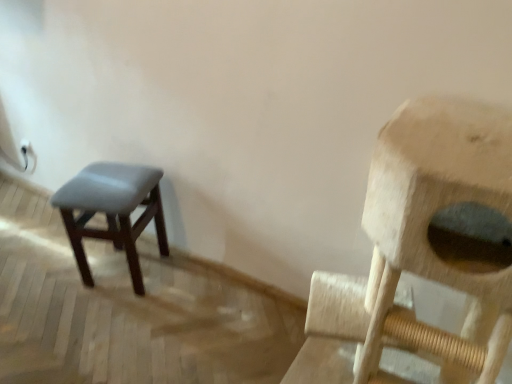
The image size is (512, 384). Find the location of `vacant space situated above matte gray stool at left (from a real-world perspective)`. vacant space situated above matte gray stool at left (from a real-world perspective) is located at coordinates (106, 179).